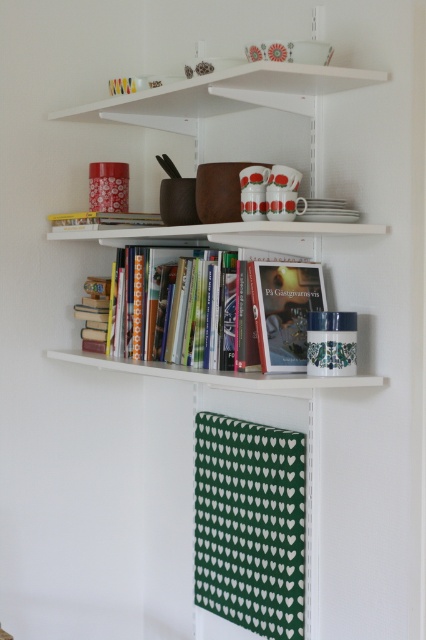
Is green paper book at center shorter than hardcover books at center?

No.

Is point (256, 632) closer to camera compared to point (183, 340)?

Yes, it is.

Identify the location of green paper book at center. The width and height of the screenshot is (426, 640). tap(250, 524).

How distant is green paper book at center from white matte bookshelf at upper center?

green paper book at center is 36.80 inches away from white matte bookshelf at upper center.

Is point (198, 529) farther from camera compared to point (124, 241)?

Yes, point (198, 529) is behind point (124, 241).

At what (x,y) coordinates should I click in order to perform the action: click on green paper book at center. Please return your answer as a coordinate pair (x, y). This screenshot has width=426, height=640. Looking at the image, I should click on (250, 524).

Is white matte bookshelf at upper center shorter than hardcover books at center?

In fact, white matte bookshelf at upper center may be taller than hardcover books at center.

Is point (181, 243) farther from viewer compared to point (126, 248)?

Yes, point (181, 243) is farther from viewer.

At what (x,y) coordinates should I click in order to perform the action: click on white matte bookshelf at upper center. Please return your answer as a coordinate pair (x, y). The width and height of the screenshot is (426, 640). Looking at the image, I should click on (227, 96).